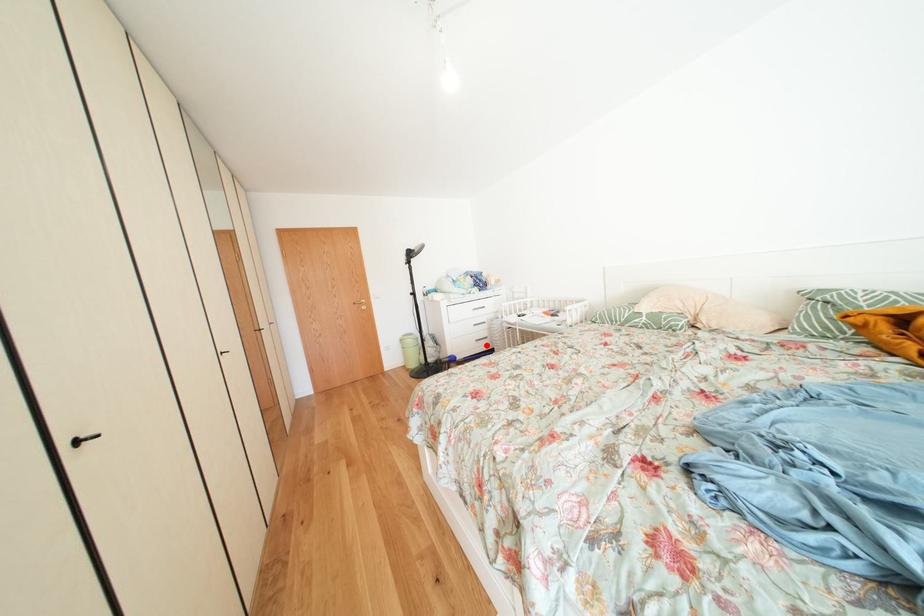
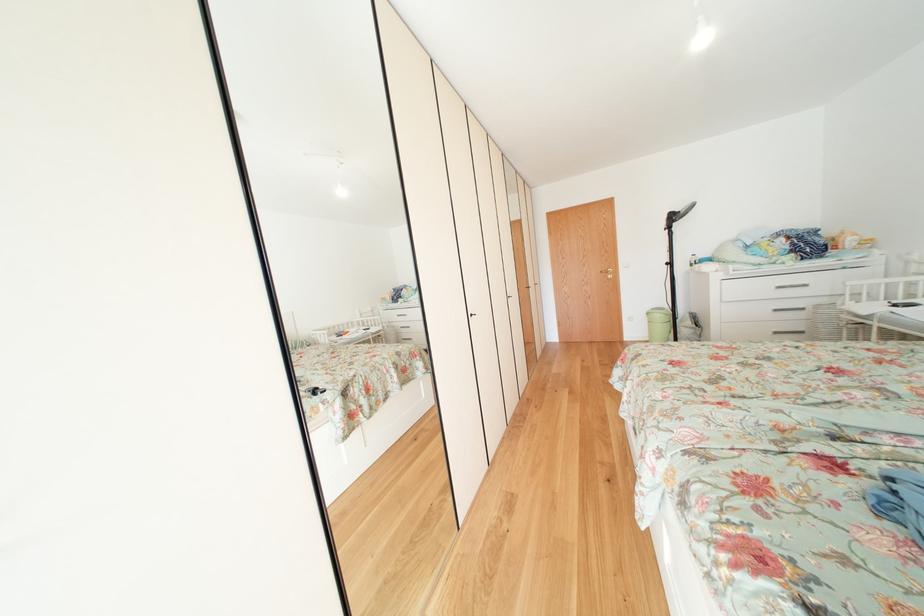
Question: I am providing you with two images of the same scene from different viewpoints. In image1, a red point is highlighted. Considering the same 3D point in image2, which of the following is correct?

Choices:
 (A) It is closer
 (B) It is farther

Answer: (A)